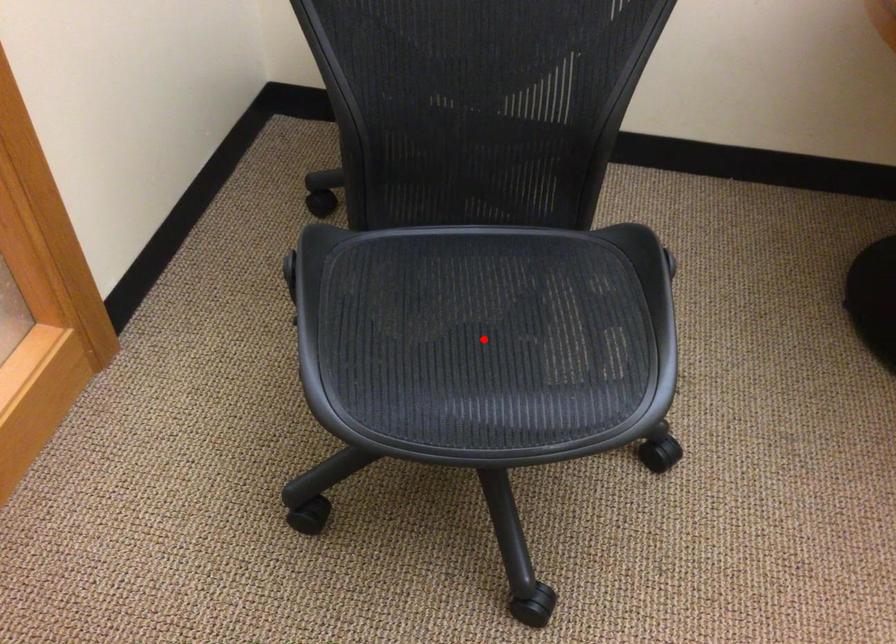
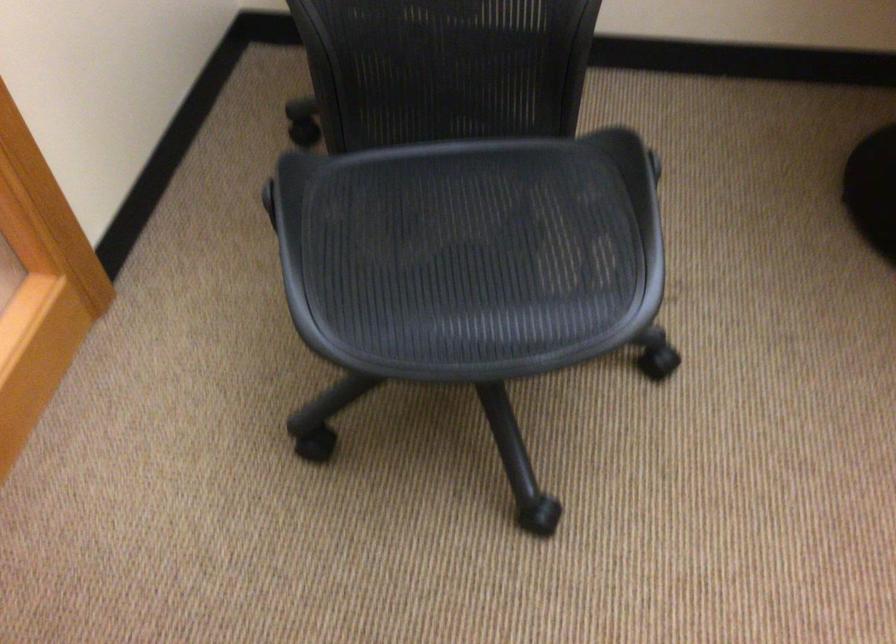
Find the pixel in the second image that matches the highlighted location in the first image.

(470, 254)